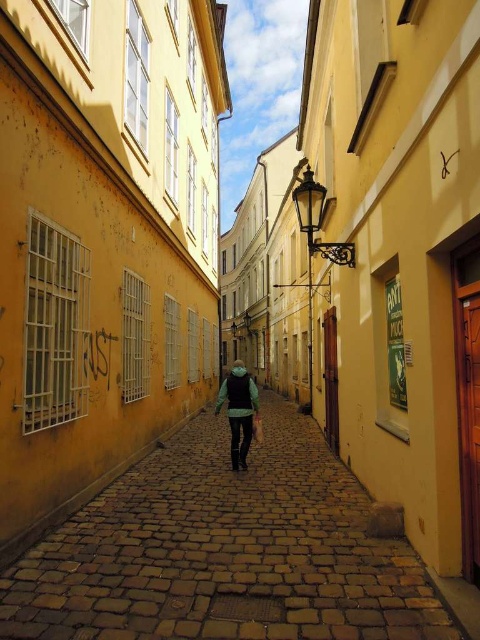
Is the position of brown cobblestone path at center more distant than that of green fabric jacket at center?

No, brown cobblestone path at center is closer to the viewer.

Does point (225, 502) lie in front of point (237, 419)?

Yes, it is in front of point (237, 419).

I want to click on brown cobblestone path at center, so click(225, 552).

Image resolution: width=480 pixels, height=640 pixels. Find the location of `brown cobblestone path at center`. brown cobblestone path at center is located at coordinates (225, 552).